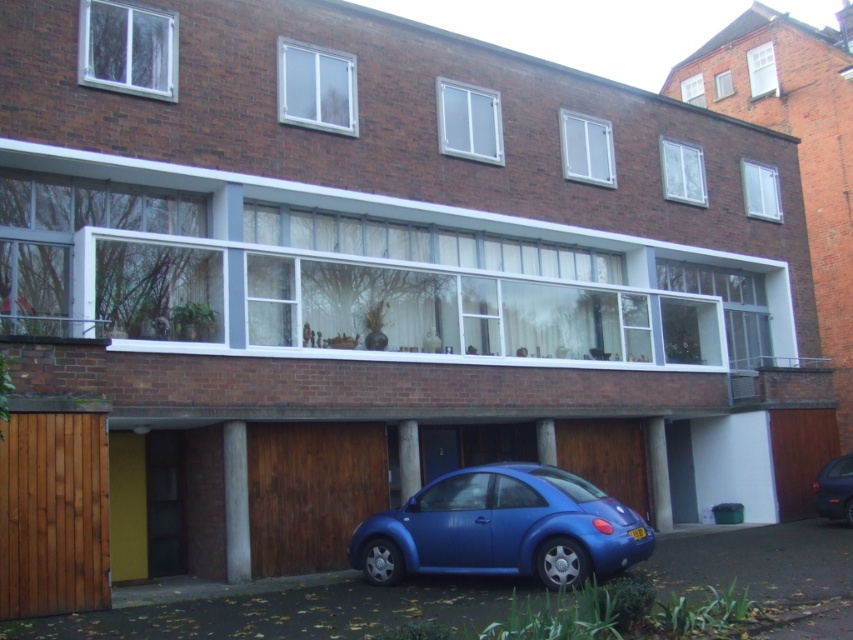
Between point (505, 525) and point (840, 472), which one is positioned in front?

Point (505, 525) is in front.

Is blue metallic car at lower center shorter than blue matte car at lower right?

No.

What are the coordinates of `blue metallic car at lower center` in the screenshot? It's located at (502, 529).

Is blue metallic car at lower center below brown wooden garage door at lower center?

Yes.

Does point (415, 566) lie behind point (312, 538)?

No, it is in front of (312, 538).

Does point (410, 538) come in front of point (320, 493)?

That is True.

Where is `blue metallic car at lower center`? This screenshot has width=853, height=640. blue metallic car at lower center is located at coordinates (502, 529).

Does brown wooden garage door at lower center have a greater height compared to blue matte car at lower right?

Yes.

Is point (300, 506) positioned behind point (816, 497)?

No, it is not.

Find the location of a particular element. The image size is (853, 640). brown wooden garage door at lower center is located at coordinates (310, 492).